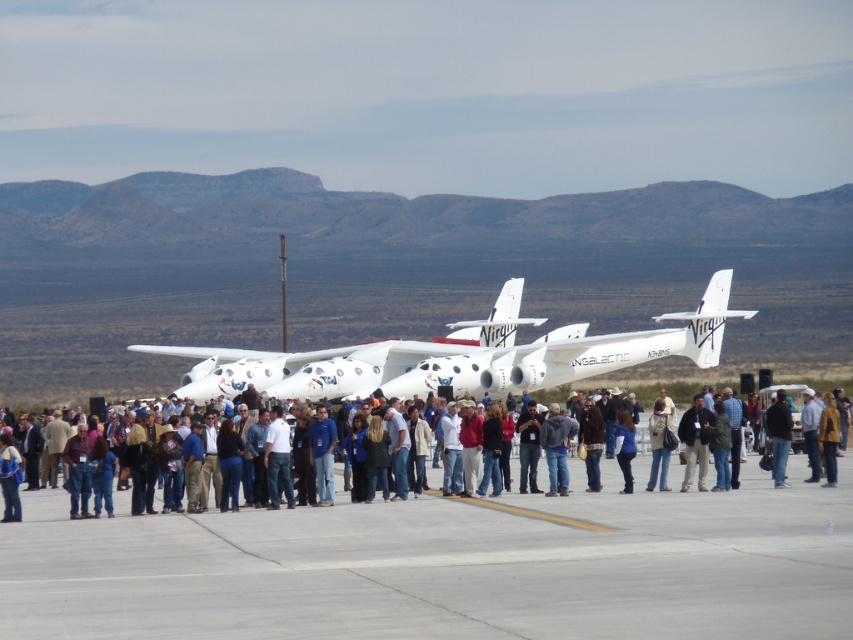
Question: Is white glossy airplane at center thinner than black leather jacket at center?

Choices:
 (A) no
 (B) yes

Answer: (A)

Question: Does white casual clothing at center lie behind black leather jacket at center?

Choices:
 (A) yes
 (B) no

Answer: (B)

Question: Observing the image, what is the correct spatial positioning of white glossy airplane at center in reference to black leather jacket at center?

Choices:
 (A) right
 (B) left

Answer: (B)

Question: Which of the following is the farthest from the observer?

Choices:
 (A) (683, 314)
 (B) (782, 477)
 (C) (840, 493)
 (D) (587, 522)

Answer: (A)

Question: Among these points, which one is farthest from the camera?

Choices:
 (A) (260, 371)
 (B) (767, 417)

Answer: (A)

Question: Which object appears farthest from the camera in this image?

Choices:
 (A) gray concrete tarmac at center
 (B) black leather jacket at center
 (C) white glossy airplane at center

Answer: (C)